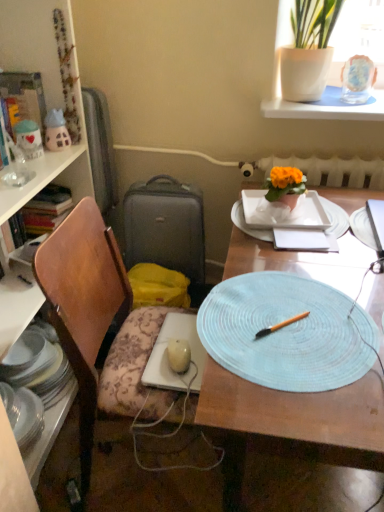
Locate an element on the screen. The image size is (384, 512). vacant space in between orange matte flower pot at upper right and light blue woven placemat at center, which is the second platter in back-to-front order is located at coordinates (285, 250).